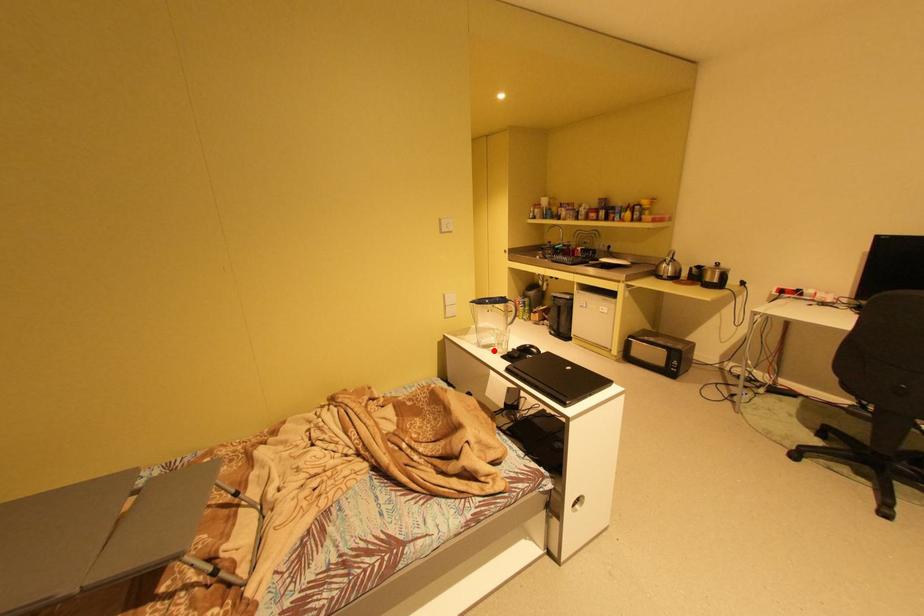
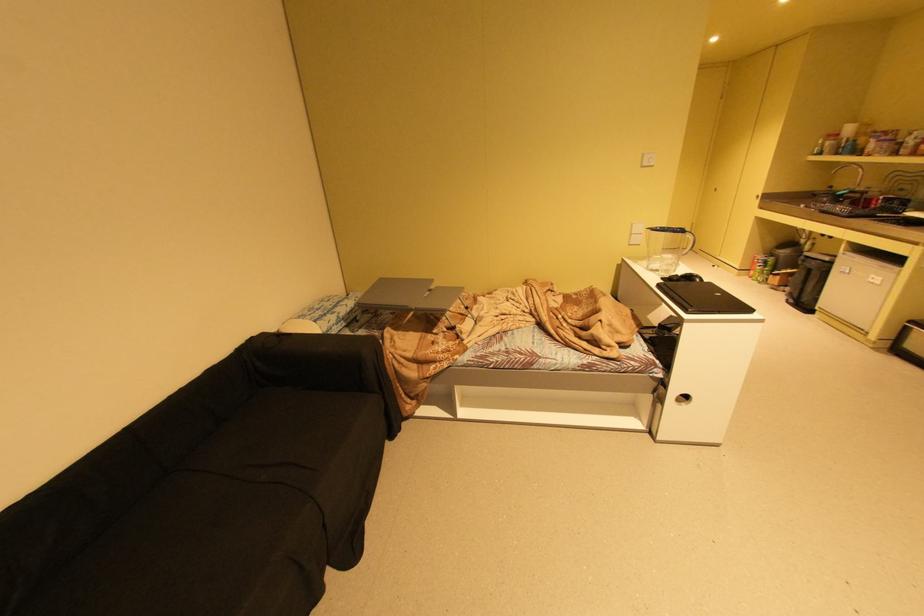
In the second image, find the point that corresponds to the highlighted location in the first image.

(659, 273)